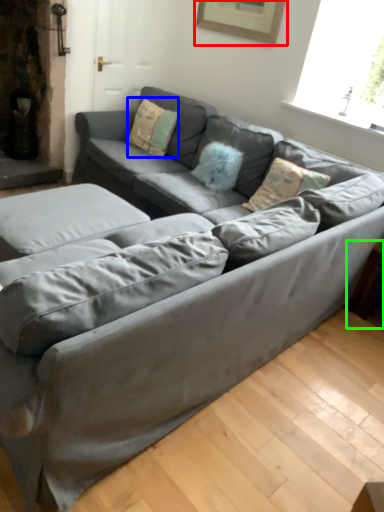
Question: Which object is positioned farthest from picture frame (highlighted by a red box)? Select from pillow (highlighted by a blue box) and side table (highlighted by a green box).

Choices:
 (A) pillow
 (B) side table

Answer: (B)